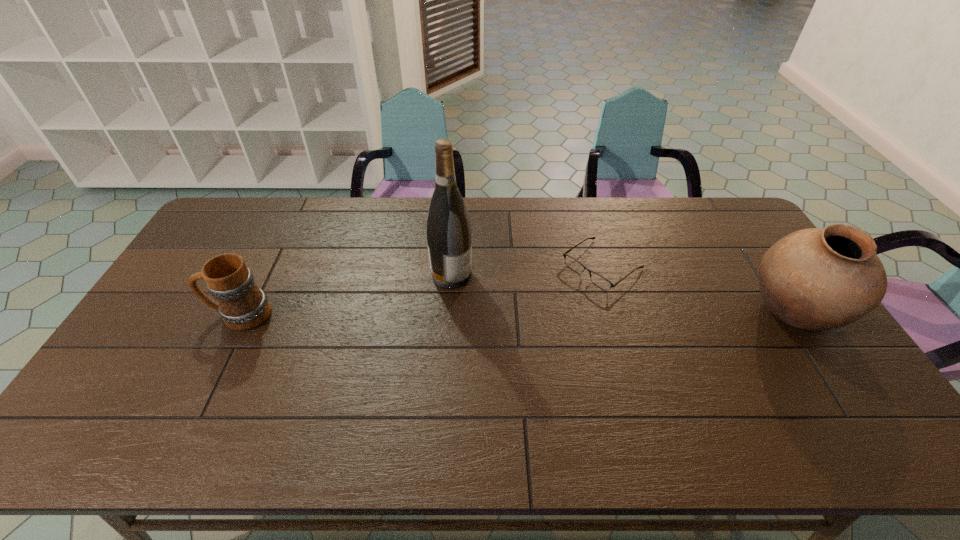
I want to click on vacant space on the desktop that is between the mug and the pottery and is positioned on the label of the wine bottle, so click(523, 314).

Identify the location of free space on the desktop that is between the leftmost object and the second tallest object and is positioned on the front-facing side of the shortest object. This screenshot has height=540, width=960. (540, 314).